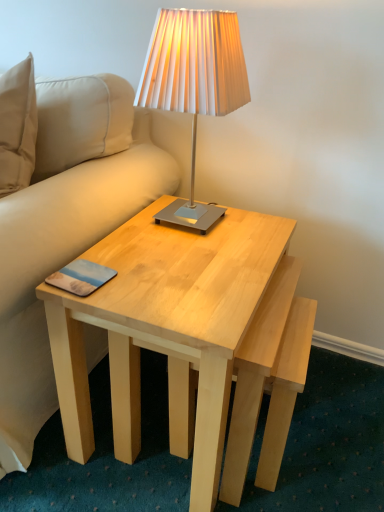
Question: Does point (205, 66) appear closer or farther from the camera than point (99, 286)?

Choices:
 (A) closer
 (B) farther

Answer: (B)

Question: Is matte silver lamp at upper center wider or thinner than matte plastic pad at lower left?

Choices:
 (A) wide
 (B) thin

Answer: (A)

Question: Which is nearer to the matte plastic pad at lower left?

Choices:
 (A) matte silver lamp at upper center
 (B) light wood coffee table at center

Answer: (B)

Question: Which is nearer to the matte silver lamp at upper center?

Choices:
 (A) light wood coffee table at center
 (B) matte plastic pad at lower left

Answer: (A)